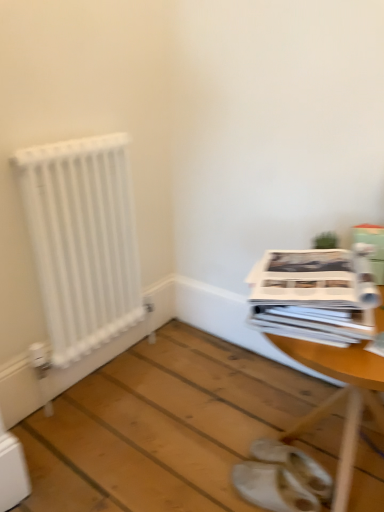
The width and height of the screenshot is (384, 512). Describe the element at coordinates (82, 240) in the screenshot. I see `white matte radiator at left` at that location.

Identify the location of white glossy magazine at right. The width and height of the screenshot is (384, 512). (315, 295).

Describe the element at coordinates (339, 398) in the screenshot. I see `wooden table at center` at that location.

Where is `white matte radiator at left`? This screenshot has height=512, width=384. white matte radiator at left is located at coordinates (82, 240).

Is green cardboard box at upper right directly adjacent to white matte radiator at left?

green cardboard box at upper right is not next to white matte radiator at left, and they're not touching.

Considering the sizes of objects green cardboard box at upper right and white matte radiator at left in the image provided, who is taller, green cardboard box at upper right or white matte radiator at left?

white matte radiator at left is taller.

Which object is further away from the camera, green cardboard box at upper right or white matte radiator at left?

white matte radiator at left is further from the camera.

Between green cardboard box at upper right and white matte radiator at left, which one has smaller size?

Smaller between the two is green cardboard box at upper right.

Could you tell me if white matte radiator at left is turned towards wooden table at center?

Yes, white matte radiator at left faces towards wooden table at center.

From a real-world perspective, between white matte radiator at left and wooden table at center, who is vertically higher?

white matte radiator at left is physically above.

Between point (99, 153) and point (344, 357), which one is positioned in front?

The point (344, 357) is in front.

Is white matte radiator at left to the left of wooden table at center from the viewer's perspective?

Correct, you'll find white matte radiator at left to the left of wooden table at center.

Considering the sizes of objects green cardboard box at upper right and white leather sandals at lower center in the image provided, who is wider, green cardboard box at upper right or white leather sandals at lower center?

Wider between the two is white leather sandals at lower center.

Is green cardboard box at upper right outside of white leather sandals at lower center?

Yes, green cardboard box at upper right is located beyond the bounds of white leather sandals at lower center.

From a real-world perspective, between green cardboard box at upper right and white leather sandals at lower center, who is vertically higher?

green cardboard box at upper right is physically above.

Considering the relative sizes of green cardboard box at upper right and white leather sandals at lower center in the image provided, is green cardboard box at upper right shorter than white leather sandals at lower center?

Incorrect, the height of green cardboard box at upper right does not fall short of that of white leather sandals at lower center.

Are white glossy magazine at right and white matte radiator at left far apart?

Actually, white glossy magazine at right and white matte radiator at left are a little close together.

Who is taller, white glossy magazine at right or white matte radiator at left?

white matte radiator at left.

In the scene shown: Does white glossy magazine at right lie behind white matte radiator at left?

No, white glossy magazine at right is in front of white matte radiator at left.

You are a GUI agent. You are given a task and a screenshot of the screen. Output one action in this format:
    pyautogui.click(x=<x>, y=<y>)
    Task: Click on the radiator located above the white glossy magazine at right (from the image's perspective)
    This screenshot has height=512, width=384.
    Given the screenshot: What is the action you would take?
    (x=82, y=240)

Can you confirm if white matte radiator at left is thinner than green cardboard box at upper right?

Yes, white matte radiator at left is thinner than green cardboard box at upper right.

Between white matte radiator at left and green cardboard box at upper right, which one appears on the right side from the viewer's perspective?

Positioned to the right is green cardboard box at upper right.

Is white matte radiator at left aimed at green cardboard box at upper right?

Yes, white matte radiator at left is turned towards green cardboard box at upper right.

In terms of size, does wooden table at center appear bigger or smaller than green cardboard box at upper right?

Clearly, wooden table at center is larger in size than green cardboard box at upper right.

Considering the sizes of wooden table at center and green cardboard box at upper right in the image, is wooden table at center wider or thinner than green cardboard box at upper right?

Clearly, wooden table at center has more width compared to green cardboard box at upper right.

From a real-world perspective, is wooden table at center physically located above or below green cardboard box at upper right?

Clearly, from a real-world perspective, wooden table at center is below green cardboard box at upper right.

Is wooden table at center aimed at green cardboard box at upper right?

No, wooden table at center is not oriented towards green cardboard box at upper right.

Which is behind, point (311, 476) or point (28, 188)?

Point (28, 188)

Would you say white leather sandals at lower center is inside or outside white matte radiator at left?

white leather sandals at lower center cannot be found inside white matte radiator at left.

Identify the location of footwear in front of the white matte radiator at left. (295, 465).

Is white leather sandals at lower center shorter than white matte radiator at left?

Correct, white leather sandals at lower center is not as tall as white matte radiator at left.

Locate an element on the screen. The image size is (384, 512). cardboard box that is above the white matte radiator at left (from the image's perspective) is located at coordinates (373, 247).

Identify the location of table below the white matte radiator at left (from a real-world perspective). This screenshot has width=384, height=512. (339, 398).

Based on their spatial positions, is white glossy magazine at right or white matte radiator at left closer to white leather sandals at lower center?

white glossy magazine at right.

Considering their positions, is white glossy magazine at right positioned closer to white leather sandals at lower center than green cardboard box at upper right?

white glossy magazine at right is positioned closer to the anchor white leather sandals at lower center.

From the picture: Estimate the real-world distances between objects in this image. Which object is further from wooden table at center, green cardboard box at upper right or white leather sandals at lower center?

green cardboard box at upper right lies further to wooden table at center than the other object.

From the image, which object appears to be farther from white matte radiator at left, green cardboard box at upper right or wooden table at center?

Among the two, wooden table at center is located further to white matte radiator at left.

Looking at the image, which one is located closer to wooden table at center, white leather sandals at lower center or white glossy magazine at right?

white leather sandals at lower center is closer to wooden table at center.

From the image, which object appears to be nearer to wooden table at center, white glossy magazine at right or green cardboard box at upper right?

The object closer to wooden table at center is white glossy magazine at right.

Consider the image. When comparing their distances from white matte radiator at left, does white glossy magazine at right or green cardboard box at upper right seem further?

green cardboard box at upper right lies further to white matte radiator at left than the other object.

When comparing their distances from white glossy magazine at right, does green cardboard box at upper right or white matte radiator at left seem further?

white matte radiator at left lies further to white glossy magazine at right than the other object.

Identify the location of footwear between white matte radiator at left and green cardboard box at upper right from left to right. This screenshot has height=512, width=384. (295, 465).

This screenshot has height=512, width=384. In order to click on table between white glossy magazine at right and white leather sandals at lower center from top to bottom in this screenshot , I will do `click(339, 398)`.

This screenshot has height=512, width=384. I want to click on table between green cardboard box at upper right and white leather sandals at lower center vertically, so click(339, 398).

Locate an element on the screen. The height and width of the screenshot is (512, 384). footwear situated between white matte radiator at left and white glossy magazine at right from left to right is located at coordinates (295, 465).